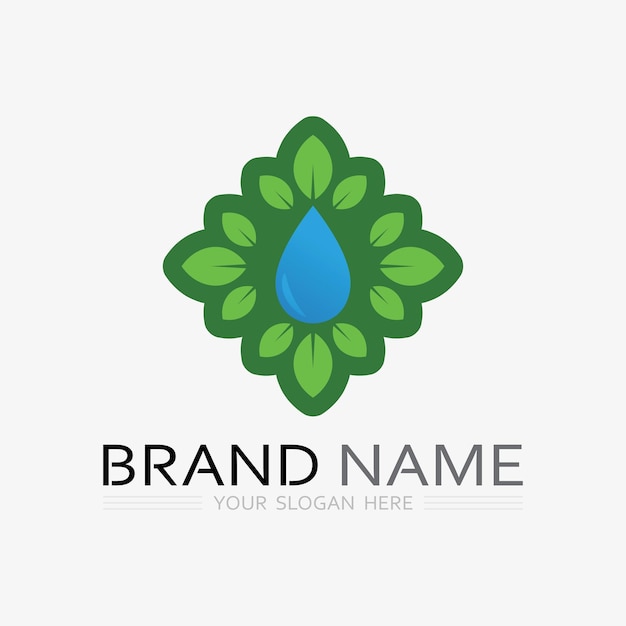
Where is `plant`? plant is located at coordinates (370, 257).